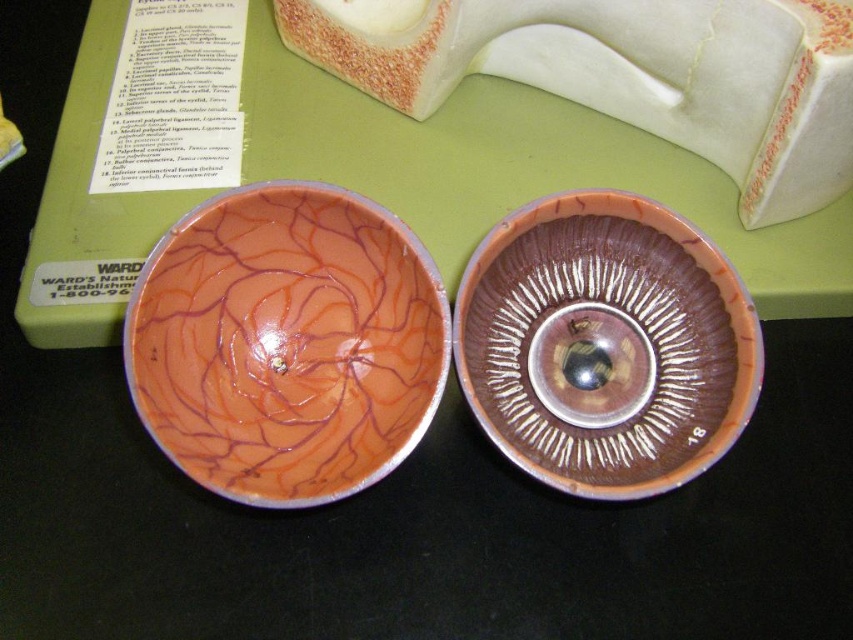
Question: Can you confirm if matte orange bowl at center is positioned to the right of shiny brown bowl at center?

Choices:
 (A) no
 (B) yes

Answer: (A)

Question: Does matte orange bowl at center appear on the left side of shiny brown bowl at center?

Choices:
 (A) no
 (B) yes

Answer: (B)

Question: Where is matte orange bowl at center located in relation to shiny brown bowl at center in the image?

Choices:
 (A) below
 (B) above

Answer: (B)

Question: Which of the following is the closest to the observer?

Choices:
 (A) matte orange bowl at center
 (B) shiny brown bowl at center

Answer: (A)